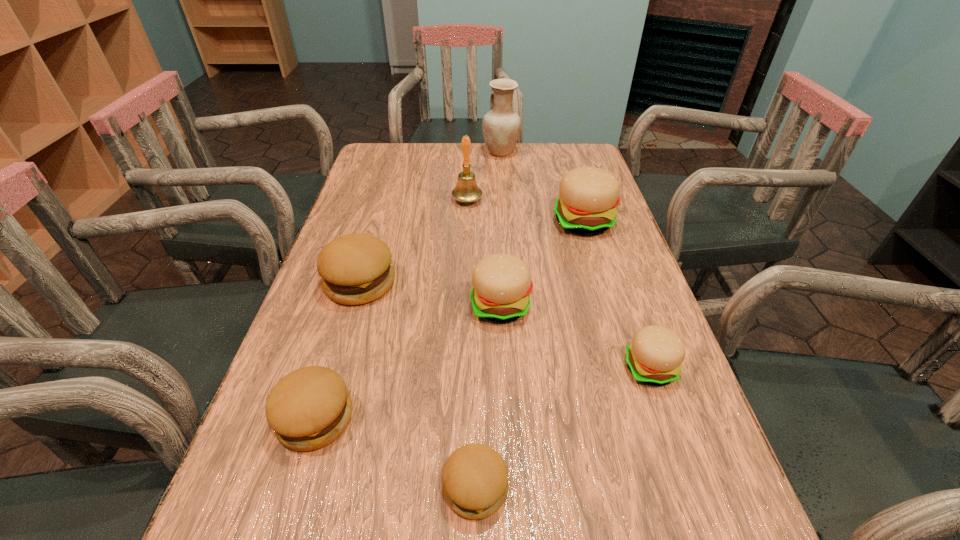
At what (x,y) coordinates should I click in order to perform the action: click on the farthest object. Please return your answer as a coordinate pair (x, y). This screenshot has height=540, width=960. Looking at the image, I should click on (501, 126).

You are a GUI agent. You are given a task and a screenshot of the screen. Output one action in this format:
    pyautogui.click(x=<x>, y=<y>)
    Task: Click on the pink pottery
    Image resolution: width=960 pixels, height=540 pixels.
    Given the screenshot: What is the action you would take?
    pyautogui.click(x=501, y=126)

Locate an element on the screen. bell is located at coordinates (466, 190).

I want to click on the biggest beige hamburger, so click(x=588, y=196).

The height and width of the screenshot is (540, 960). What are the coordinates of `the sixth shortest object` in the screenshot? It's located at (588, 196).

The height and width of the screenshot is (540, 960). Identify the location of the second nearest beige hamburger. (502, 284).

Find the location of `the leftmost beige hamburger`. the leftmost beige hamburger is located at coordinates (502, 284).

Locate an element on the screen. Image resolution: width=960 pixels, height=540 pixels. the farthest brown hamburger is located at coordinates (356, 268).

Where is `the second farthest brown hamburger`? the second farthest brown hamburger is located at coordinates (309, 408).

The width and height of the screenshot is (960, 540). Identify the location of the nearest beige hamburger. (654, 357).